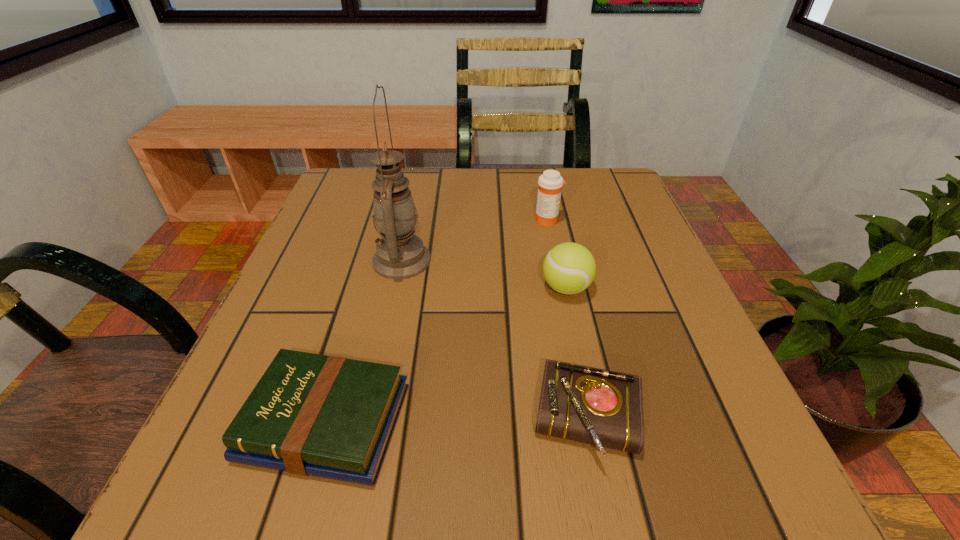
The image size is (960, 540). In order to click on the tallest object in this screenshot , I will do `click(400, 254)`.

Identify the location of medicine. (550, 183).

This screenshot has height=540, width=960. I want to click on the farthest object, so (x=550, y=183).

Image resolution: width=960 pixels, height=540 pixels. I want to click on the third tallest object, so click(x=569, y=268).

Where is `book`? book is located at coordinates (326, 416).

In order to click on diary in this screenshot , I will do [x=595, y=406].

I want to click on vacant position located on the right of the oil lamp, so click(x=612, y=260).

Image resolution: width=960 pixels, height=540 pixels. I want to click on free region located 0.190m on the right of the farthest object, so click(x=646, y=220).

Find the location of a particular element. free space located 0.160m on the front of the third tallest object is located at coordinates (586, 380).

Where is `free space located 0.220m on the back of the book`? This screenshot has width=960, height=540. free space located 0.220m on the back of the book is located at coordinates (369, 275).